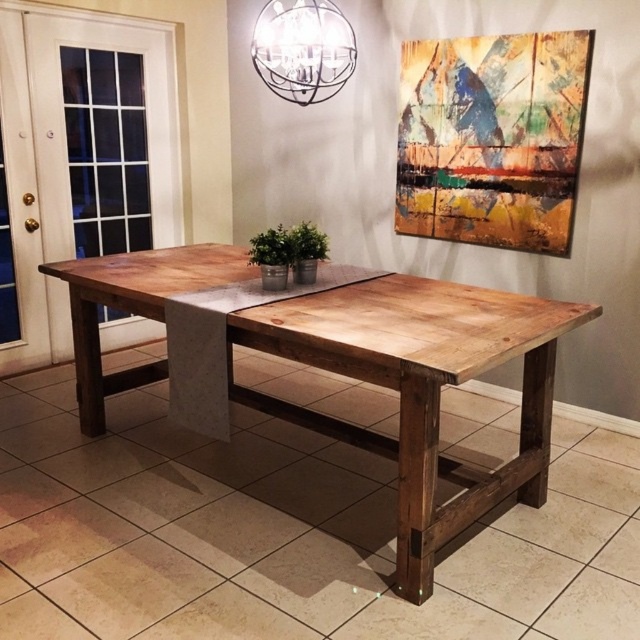
Question: Among these points, which one is nearest to the camera?

Choices:
 (A) (317, 44)
 (B) (408, 536)

Answer: (B)

Question: Is wooden table at center below metallic sphere at upper center?

Choices:
 (A) yes
 (B) no

Answer: (A)

Question: Observing the image, what is the correct spatial positioning of wooden table at center in reference to metallic sphere at upper center?

Choices:
 (A) below
 (B) above

Answer: (A)

Question: Is wooden table at center above metallic sphere at upper center?

Choices:
 (A) no
 (B) yes

Answer: (A)

Question: Among these objects, which one is farthest from the camera?

Choices:
 (A) wooden table at center
 (B) metallic sphere at upper center

Answer: (B)